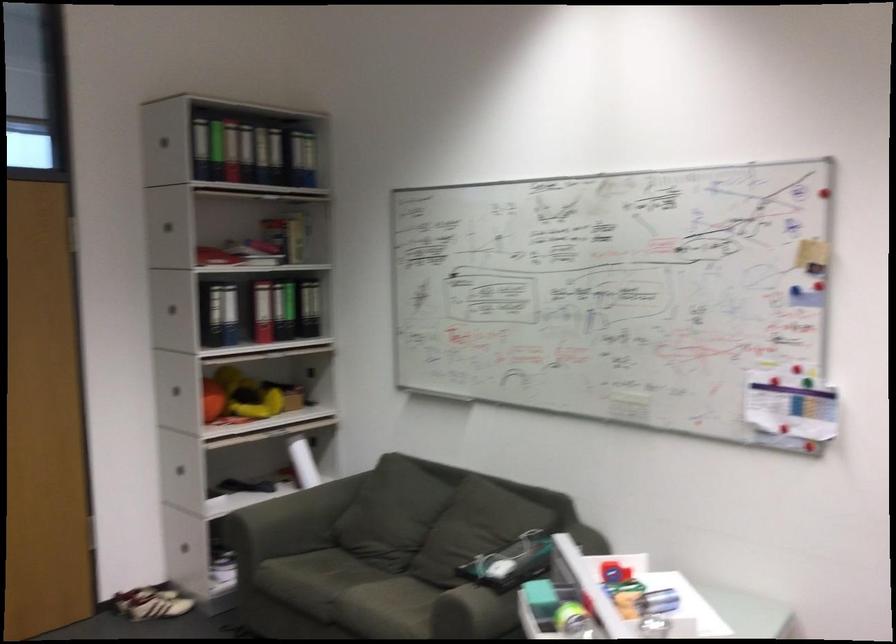
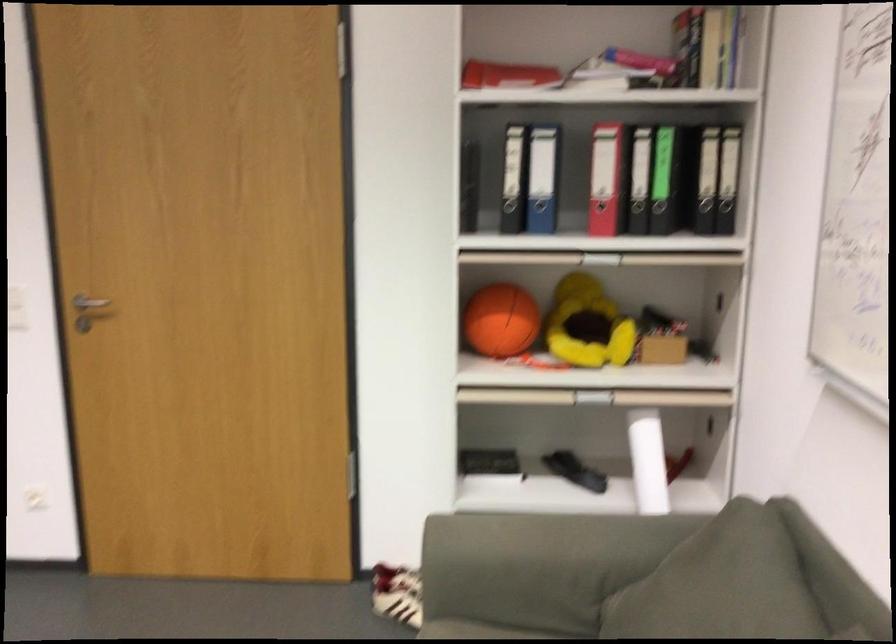
The point at [195,507] is marked in the first image. Where is the corresponding point in the second image?

(489, 464)